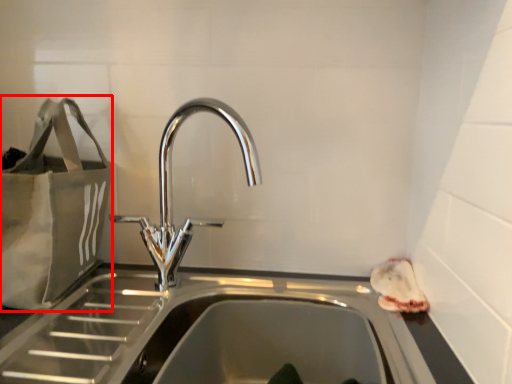
Question: Considering the relative positions of bag (annotated by the red box) and tap in the image provided, where is bag (annotated by the red box) located with respect to the staircase?

Choices:
 (A) left
 (B) right

Answer: (A)